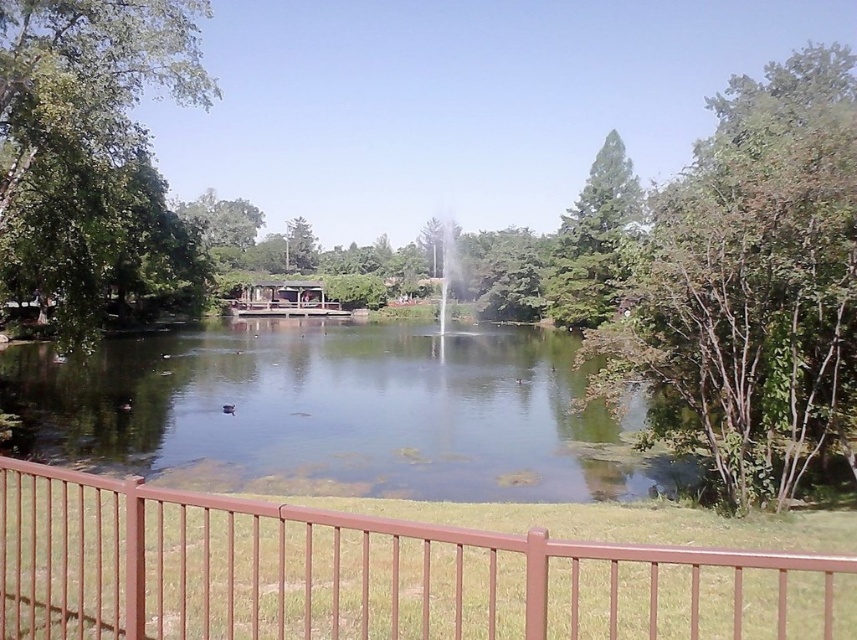
Question: Can you confirm if clear water at center is smaller than wooden gazebo at center?

Choices:
 (A) no
 (B) yes

Answer: (A)

Question: Can you confirm if clear water at center is positioned below wooden gazebo at center?

Choices:
 (A) no
 (B) yes

Answer: (B)

Question: Among these objects, which one is nearest to the camera?

Choices:
 (A) green leafy tree at right
 (B) green leafy tree at left
 (C) clear water at center

Answer: (A)

Question: Which point is closer to the camera taking this photo?

Choices:
 (A) (22, 150)
 (B) (411, 406)
 (C) (268, 292)

Answer: (A)

Question: Which object is closer to the camera taking this photo?

Choices:
 (A) wooden gazebo at center
 (B) brown metal fence at lower center

Answer: (B)

Question: Is clear water at center further to camera compared to green leafy tree at right?

Choices:
 (A) yes
 (B) no

Answer: (A)